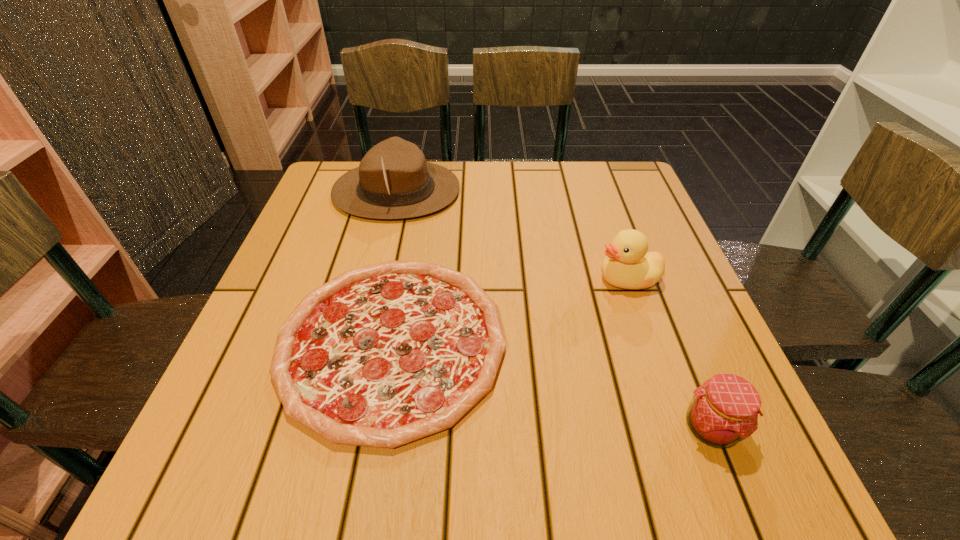
This screenshot has height=540, width=960. In order to click on free point between the second shortest object and the fedora in this screenshot , I will do `click(554, 309)`.

You are a GUI agent. You are given a task and a screenshot of the screen. Output one action in this format:
    pyautogui.click(x=<x>, y=<y>)
    Task: Click on the free space between the third shortest object and the second shortest object
    
    Given the screenshot: What is the action you would take?
    pyautogui.click(x=669, y=353)

Where is `free spot between the duck and the pizza`? This screenshot has width=960, height=540. free spot between the duck and the pizza is located at coordinates (510, 310).

This screenshot has width=960, height=540. I want to click on unoccupied position between the shortest object and the jam, so click(x=551, y=384).

What are the coordinates of `free spot between the jam and the fedora` in the screenshot? It's located at (554, 309).

Where is `vacant point located between the duck and the third tallest object`? vacant point located between the duck and the third tallest object is located at coordinates (669, 353).

Identify which object is the third closest to the shortest object. Please provide its 2D coordinates. Your answer should be formatted as a tuple, i.e. [(x, y)], where the tuple contains the x and y coordinates of a point satisfying the conditions above.

[(724, 410)]

You are a GUI agent. You are given a task and a screenshot of the screen. Output one action in this format:
    pyautogui.click(x=<x>, y=<y>)
    Task: Click on the object that can be found as the second closest to the jam
    
    Given the screenshot: What is the action you would take?
    pyautogui.click(x=383, y=355)

In order to click on vacant space that satisfies the following two spatial constraints: 1. on the front side of the pizza; 2. on the right side of the third tallest object in this screenshot , I will do coord(377,427).

You are a GUI agent. You are given a task and a screenshot of the screen. Output one action in this format:
    pyautogui.click(x=<x>, y=<y>)
    Task: Click on the free region that satisfies the following two spatial constraints: 1. on the feather side of the jam; 2. on the right side of the farthest object
    The height and width of the screenshot is (540, 960).
    Given the screenshot: What is the action you would take?
    pyautogui.click(x=339, y=427)